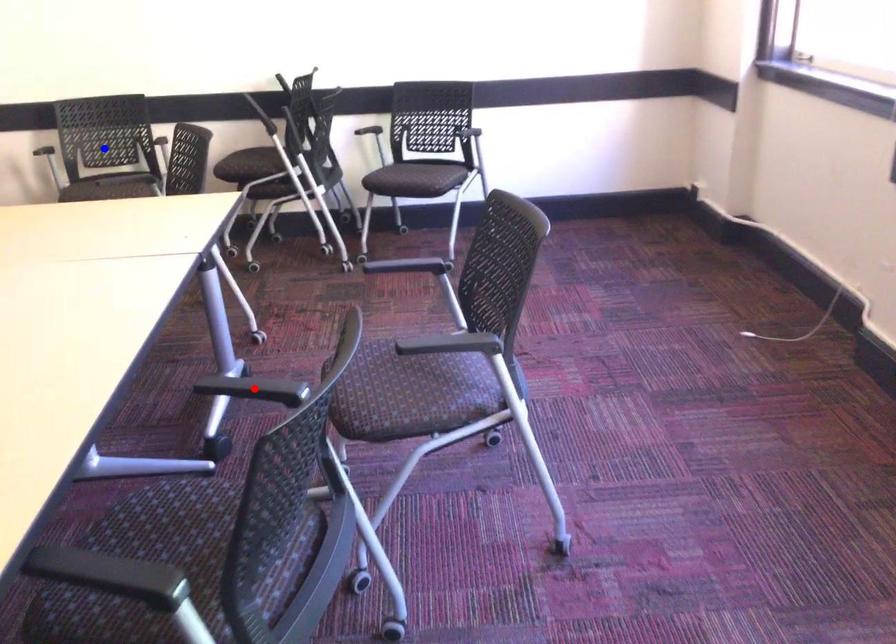
Question: Which of the two points in the image is closer to the camera?

Choices:
 (A) Blue point is closer.
 (B) Red point is closer.

Answer: (B)